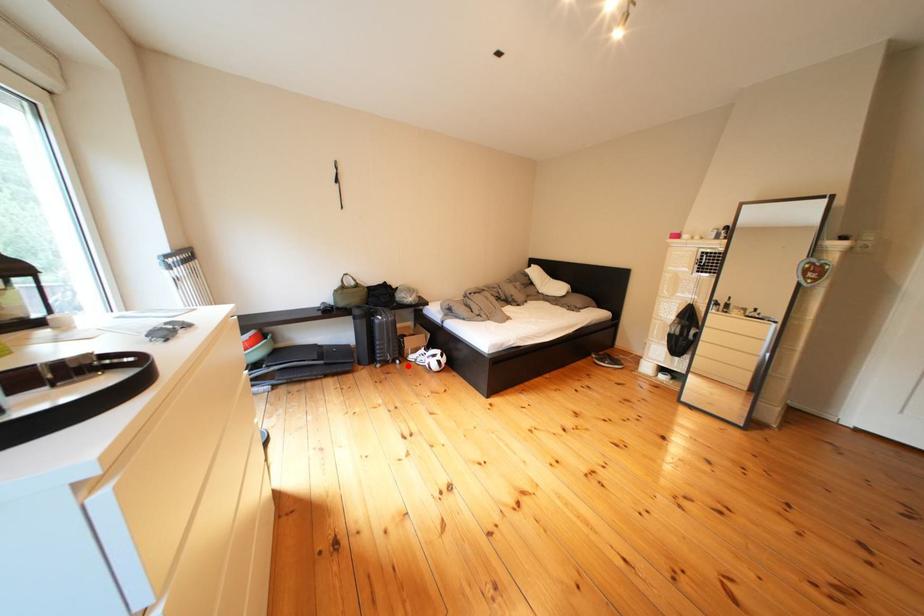
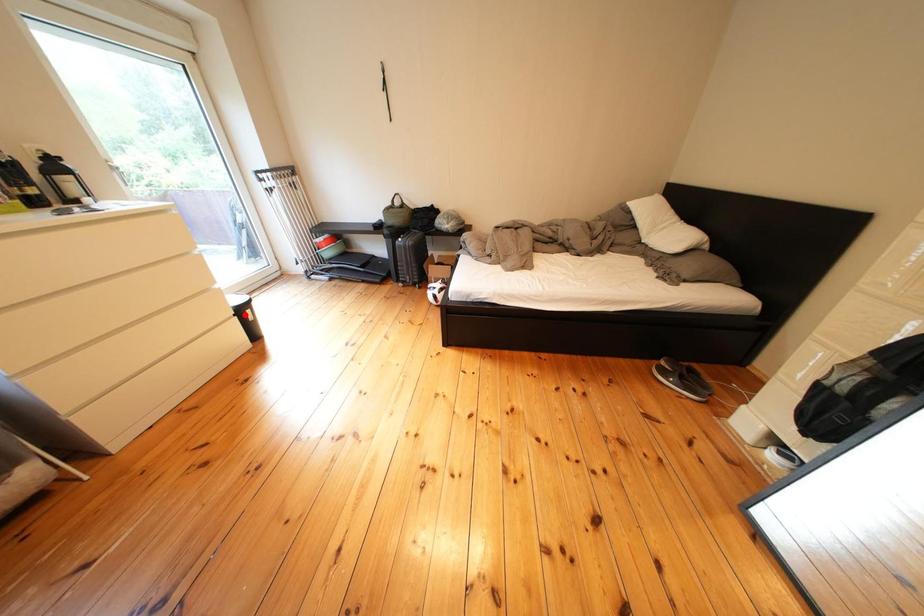
I am providing you with two images of the same scene from different viewpoints. A red point is marked on the first image and another point is marked on the second image. Is the marked point in image1 the same physical position as the marked point in image2?

No